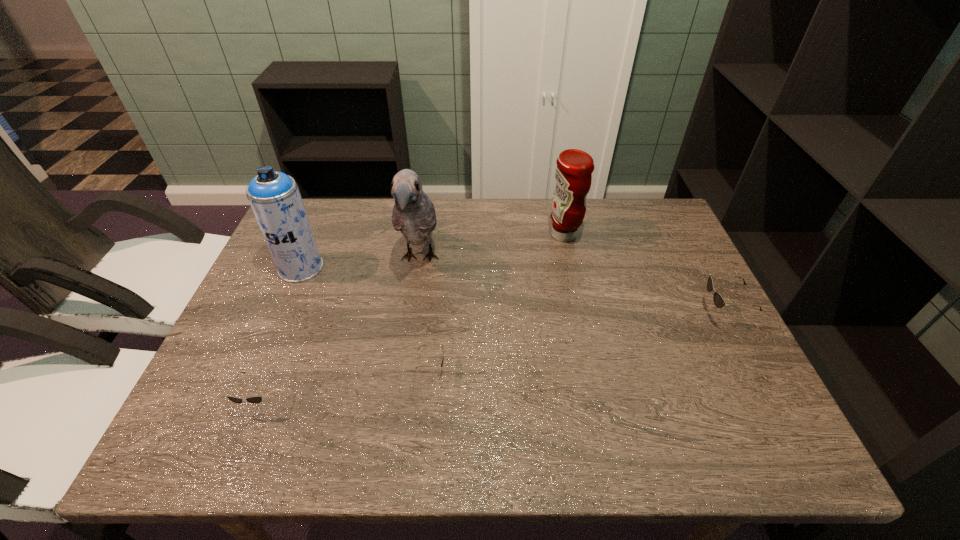
If we want them evenly spaced by inserting an extra sunglasses among them, please locate a free spot for this new sunglasses. Please provide its 2D coordinates. Your answer should be formatted as a tuple, i.e. [(x, y)], where the tuple contains the x and y coordinates of a point satisfying the conditions above.

[(585, 341)]